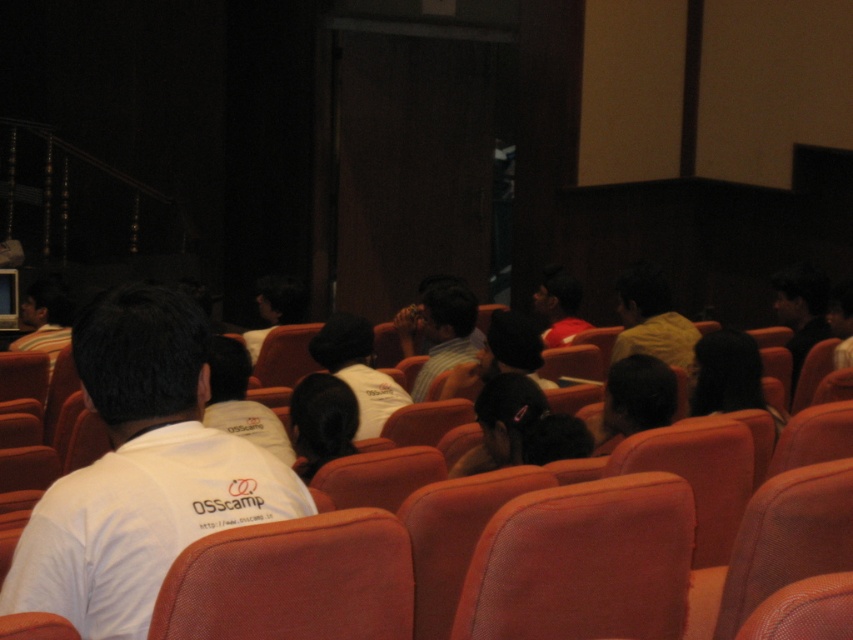
Looking at this image, which of these two, white matte shirt at center or matte red shirt at center, stands shorter?

Standing shorter between the two is matte red shirt at center.

Who is more forward, (349, 314) or (573, 300)?

Point (349, 314)

Between point (364, 323) and point (589, 324), which one is positioned behind?

The point (589, 324) is behind.

Where is `white matte shirt at center`? white matte shirt at center is located at coordinates pyautogui.click(x=357, y=369).

Is white cotton t-shirt at center above white t-shirt at left?

No.

Who is taller, white cotton t-shirt at center or white t-shirt at left?

With more height is white t-shirt at left.

Who is more distant from viewer, (241, 428) or (61, 289)?

The point (61, 289) is behind.

At what (x,y) coordinates should I click in order to perform the action: click on white cotton t-shirt at center. Please return your answer as a coordinate pair (x, y). Image resolution: width=853 pixels, height=640 pixels. Looking at the image, I should click on (241, 401).

Can you confirm if yellow matte shirt at center is taller than striped fabric shirt at center?

No, yellow matte shirt at center is not taller than striped fabric shirt at center.

The image size is (853, 640). Find the location of `yellow matte shirt at center`. yellow matte shirt at center is located at coordinates (651, 320).

Locate an element on the screen. The width and height of the screenshot is (853, 640). yellow matte shirt at center is located at coordinates (651, 320).